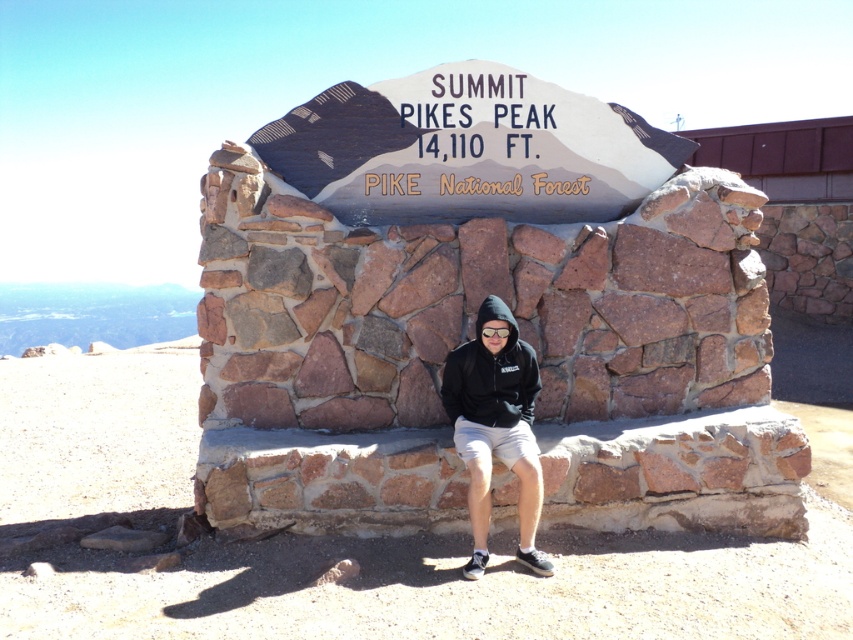
Question: Which object is closer to the camera taking this photo?

Choices:
 (A) black fleece sweatshirt at center
 (B) black hoodie at center

Answer: (B)

Question: Is black hoodie at center thinner than black fleece sweatshirt at center?

Choices:
 (A) no
 (B) yes

Answer: (A)

Question: Which point is closer to the camera?

Choices:
 (A) black fleece sweatshirt at center
 (B) black hoodie at center

Answer: (B)

Question: Is black hoodie at center to the right of black fleece sweatshirt at center from the viewer's perspective?

Choices:
 (A) yes
 (B) no

Answer: (A)

Question: Does black hoodie at center have a greater width compared to black fleece sweatshirt at center?

Choices:
 (A) yes
 (B) no

Answer: (A)